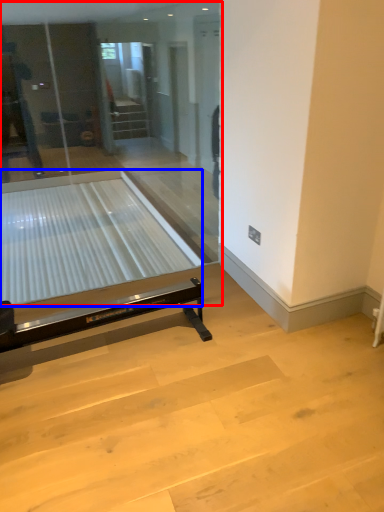
Question: Which of the following is the closest to the observer, glass door (highlighted by a red box) or glass table (highlighted by a blue box)?

Choices:
 (A) glass door
 (B) glass table

Answer: (A)